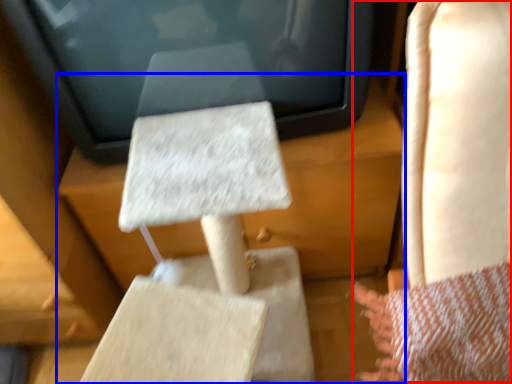
Question: Which of the following is the closest to the observer, rocking chair (highlighted by a red box) or furniture (highlighted by a blue box)?

Choices:
 (A) rocking chair
 (B) furniture

Answer: (A)